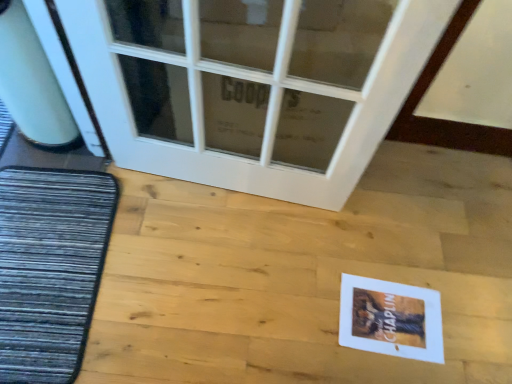
Question: Considering the relative positions of dark gray textured mat at left and white glass door at upper center in the image provided, is dark gray textured mat at left behind white glass door at upper center?

Choices:
 (A) yes
 (B) no

Answer: (A)

Question: Is the position of dark gray textured mat at left less distant than that of white glass door at upper center?

Choices:
 (A) yes
 (B) no

Answer: (B)

Question: Considering the relative sizes of dark gray textured mat at left and white glass door at upper center in the image provided, is dark gray textured mat at left taller than white glass door at upper center?

Choices:
 (A) yes
 (B) no

Answer: (B)

Question: From a real-world perspective, is dark gray textured mat at left located higher than white glass door at upper center?

Choices:
 (A) no
 (B) yes

Answer: (A)

Question: Is dark gray textured mat at left in contact with white glass door at upper center?

Choices:
 (A) no
 (B) yes

Answer: (A)

Question: Is dark gray textured mat at left located outside white glass door at upper center?

Choices:
 (A) no
 (B) yes

Answer: (B)

Question: Is white glass door at upper center shorter than dark gray textured mat at left?

Choices:
 (A) yes
 (B) no

Answer: (B)

Question: Is the depth of white glass door at upper center less than that of dark gray textured mat at left?

Choices:
 (A) yes
 (B) no

Answer: (A)

Question: Would you say white glass door at upper center contains dark gray textured mat at left?

Choices:
 (A) no
 (B) yes

Answer: (A)

Question: From the image's perspective, is white glass door at upper center below dark gray textured mat at left?

Choices:
 (A) yes
 (B) no

Answer: (B)

Question: Is white glass door at upper center not within dark gray textured mat at left?

Choices:
 (A) yes
 (B) no

Answer: (A)

Question: Can you confirm if white glass door at upper center is taller than dark gray textured mat at left?

Choices:
 (A) no
 (B) yes

Answer: (B)

Question: Can you confirm if white glass door at upper center is positioned to the right of white paper postcard at lower right?

Choices:
 (A) yes
 (B) no

Answer: (B)